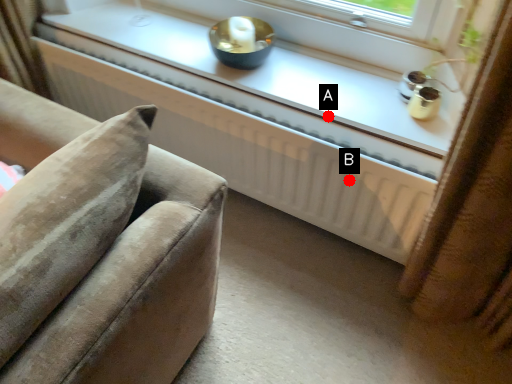
Question: Two points are circled on the image, labeled by A and B beside each circle. Which point appears farthest from the camera in this image?

Choices:
 (A) A is further
 (B) B is further

Answer: (B)